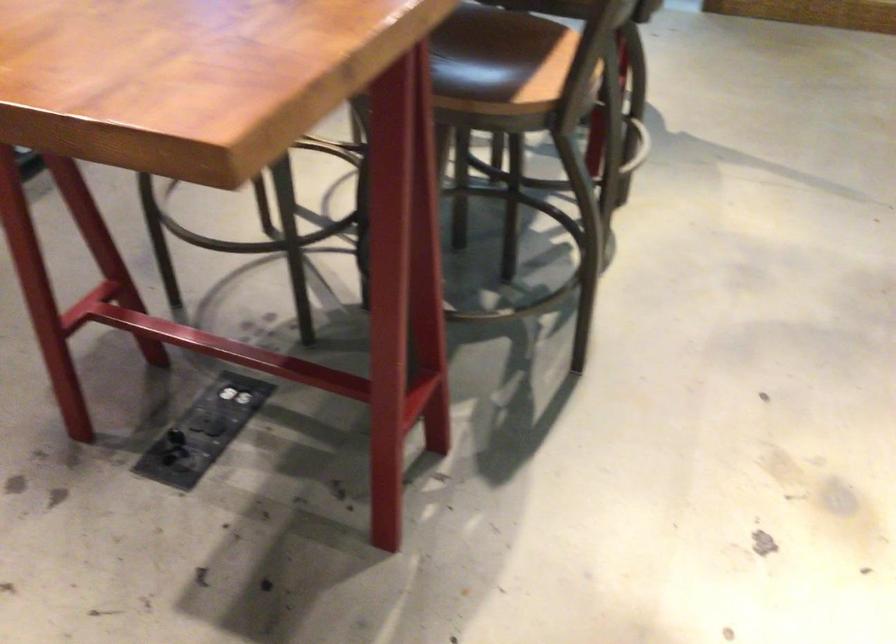
Question: The camera is either moving clockwise (left) or counter-clockwise (right) around the object. The first image is from the beginning of the video and the second image is from the end. Is the camera moving left or right when shooting the video?

Choices:
 (A) Left
 (B) Right

Answer: (B)